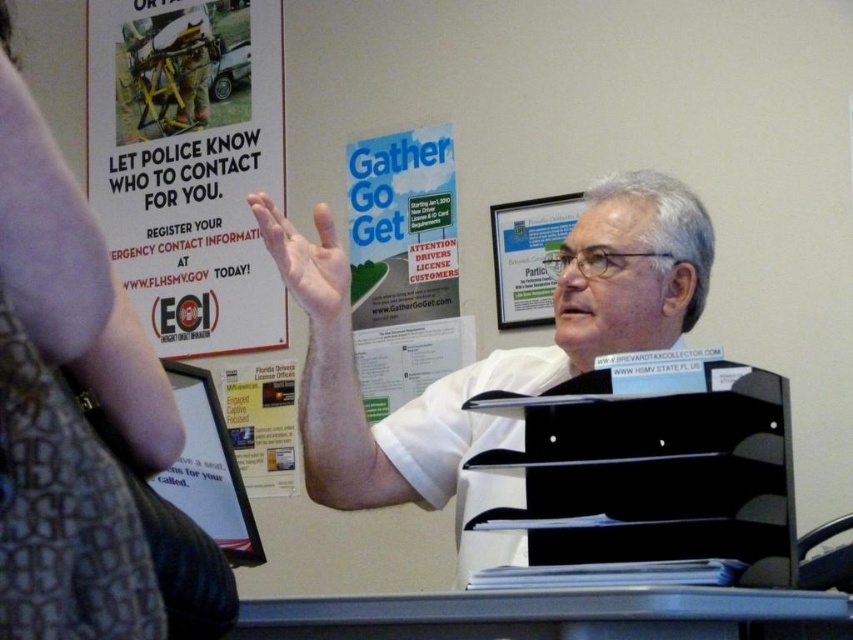
Is green paper at center behind matte paper poster at center?

No, it is not.

What do you see at coordinates (404, 264) in the screenshot? The image size is (853, 640). I see `green paper at center` at bounding box center [404, 264].

This screenshot has height=640, width=853. What are the coordinates of `green paper at center` in the screenshot? It's located at (404, 264).

This screenshot has width=853, height=640. What are the coordinates of `green paper at center` in the screenshot? It's located at (404, 264).

Does white matte shirt at center have a greater width compared to matte white hand at center?

Yes, white matte shirt at center is wider than matte white hand at center.

Which is more to the right, white matte shirt at center or matte white hand at center?

From the viewer's perspective, white matte shirt at center appears more on the right side.

Who is more forward, (584, 224) or (259, 227)?

Positioned in front is point (584, 224).

Locate an element on the screen. The width and height of the screenshot is (853, 640). white matte shirt at center is located at coordinates (490, 353).

Measure the distance between black plastic file at center and matte white hand at center.

black plastic file at center and matte white hand at center are 17.36 inches apart.

Which is in front, point (633, 440) or point (345, 326)?

Positioned in front is point (633, 440).

What do you see at coordinates (654, 468) in the screenshot? The image size is (853, 640). I see `black plastic file at center` at bounding box center [654, 468].

Locate an element on the screen. black plastic file at center is located at coordinates (654, 468).